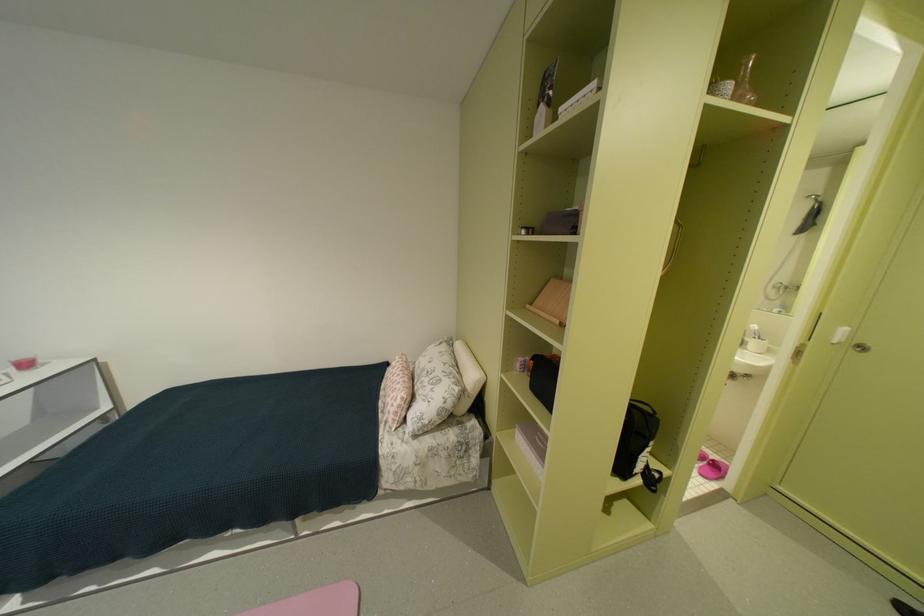
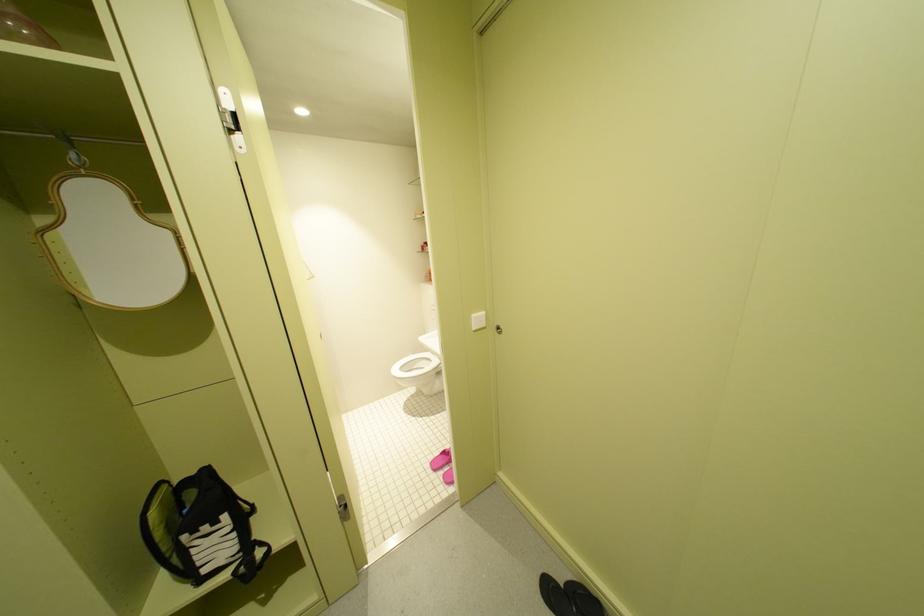
Question: The images are taken continuously from a first-person perspective. In which direction are you moving?

Choices:
 (A) Left
 (B) Right
 (C) Forward
 (D) Backward

Answer: (B)